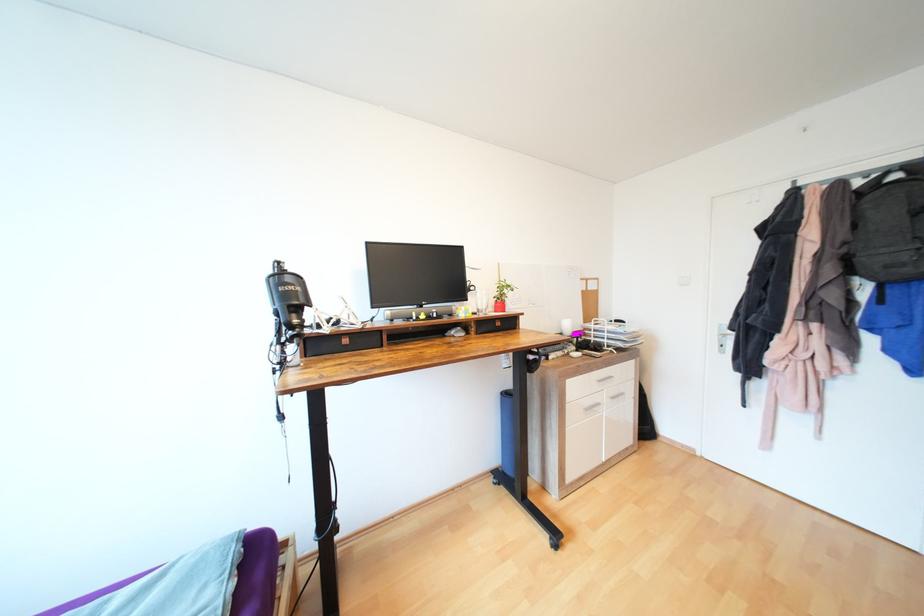
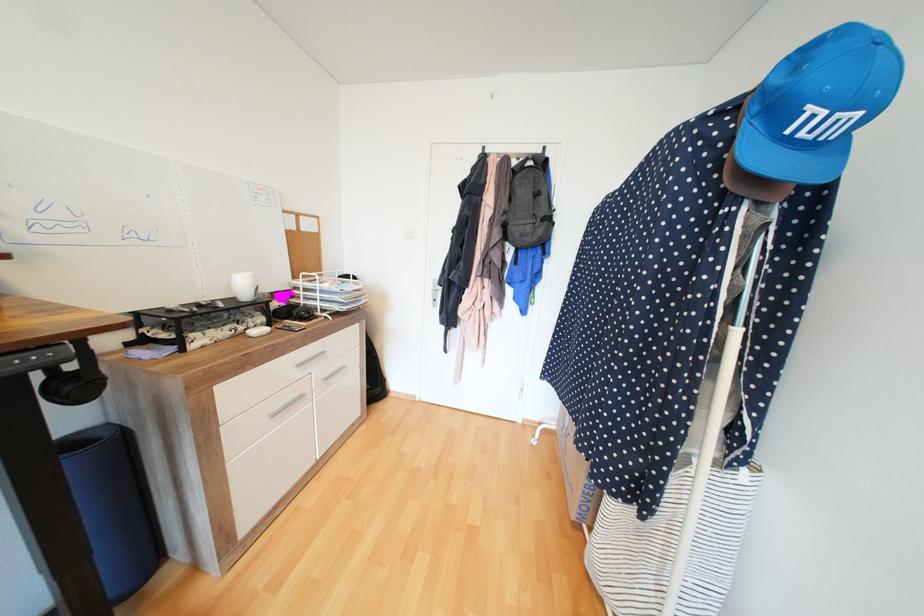
The point at (x=538, y=366) is marked in the first image. Where is the corresponding point in the second image?

(88, 387)